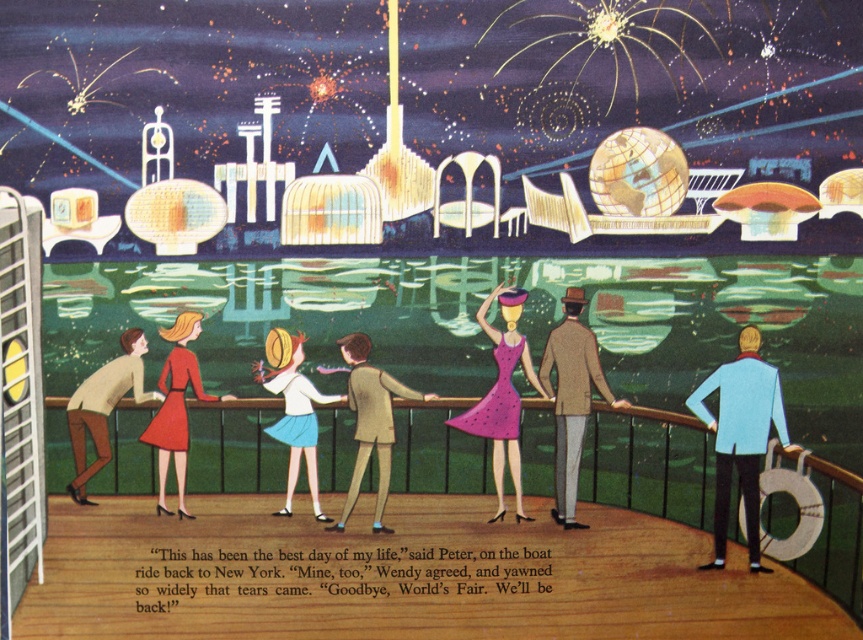
You are a photographer on the boat deck and want to take a photo that includes both the light blue fabric jacket at right and the matte red dress at lower left. What is the minimum distance you need to move backward to ensure both subjects are in frame?

The light blue fabric jacket at right and the matte red dress at lower left are 8.61 feet apart from each other. To capture both in the same frame, you need to move backward until your camera can accommodate a subject distance of at least 8.61 feet between them.